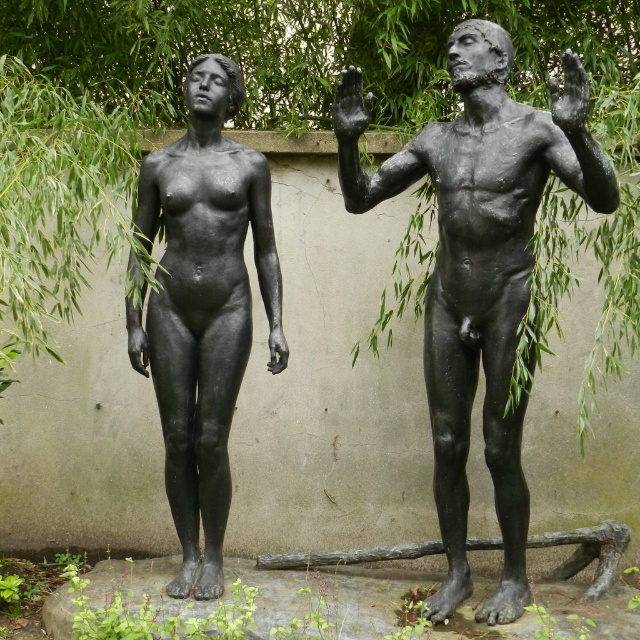
You are an artist planning to paint the scene from the perspective of someone standing in front of the statues. Which object, the green leafy tree at upper left or the matte black statue at right, will appear taller in your painting?

The matte black statue at right appears taller than the green leafy tree at upper left in the painting because the tree is shorter than the statue.

You are a gardener looking at the garden layout. You need to water both the green leafy tree at upper left and the matte black statue at right. Which object is higher up in the image?

The green leafy tree at upper left is above the matte black statue at right, so it is higher up in the image.

You are a gardener assessing the garden layout. You notice the green leafy tree at upper left and the black matte hand at upper center. Which object is positioned higher in the image?

The green leafy tree at upper left is located above the black matte hand at upper center, so the green leafy tree at upper left is positioned higher in the image.